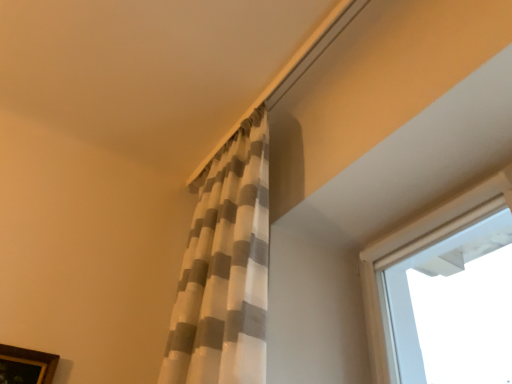
Question: Is brown wooden picture frame at lower left facing away from white textured curtain at upper center?

Choices:
 (A) no
 (B) yes

Answer: (A)

Question: Can you confirm if brown wooden picture frame at lower left is taller than white textured curtain at upper center?

Choices:
 (A) no
 (B) yes

Answer: (A)

Question: Does brown wooden picture frame at lower left turn towards white textured curtain at upper center?

Choices:
 (A) yes
 (B) no

Answer: (B)

Question: Is brown wooden picture frame at lower left at the right side of white textured curtain at upper center?

Choices:
 (A) no
 (B) yes

Answer: (A)

Question: Can you confirm if brown wooden picture frame at lower left is positioned to the left of white textured curtain at upper center?

Choices:
 (A) no
 (B) yes

Answer: (B)

Question: Is brown wooden picture frame at lower left outside of white textured curtain at upper center?

Choices:
 (A) yes
 (B) no

Answer: (A)

Question: Is white textured curtain at upper center next to brown wooden picture frame at lower left and touching it?

Choices:
 (A) no
 (B) yes

Answer: (A)

Question: From a real-world perspective, is white textured curtain at upper center physically above brown wooden picture frame at lower left?

Choices:
 (A) yes
 (B) no

Answer: (A)

Question: From a real-world perspective, is white textured curtain at upper center located beneath brown wooden picture frame at lower left?

Choices:
 (A) no
 (B) yes

Answer: (A)

Question: Considering the relative positions of white textured curtain at upper center and brown wooden picture frame at lower left in the image provided, is white textured curtain at upper center to the left of brown wooden picture frame at lower left from the viewer's perspective?

Choices:
 (A) yes
 (B) no

Answer: (B)

Question: Does white textured curtain at upper center have a larger size compared to brown wooden picture frame at lower left?

Choices:
 (A) yes
 (B) no

Answer: (A)

Question: From the image's perspective, is white textured curtain at upper center located beneath brown wooden picture frame at lower left?

Choices:
 (A) no
 (B) yes

Answer: (A)

Question: Looking at the image, does white textured curtain at upper center seem bigger or smaller compared to brown wooden picture frame at lower left?

Choices:
 (A) small
 (B) big

Answer: (B)